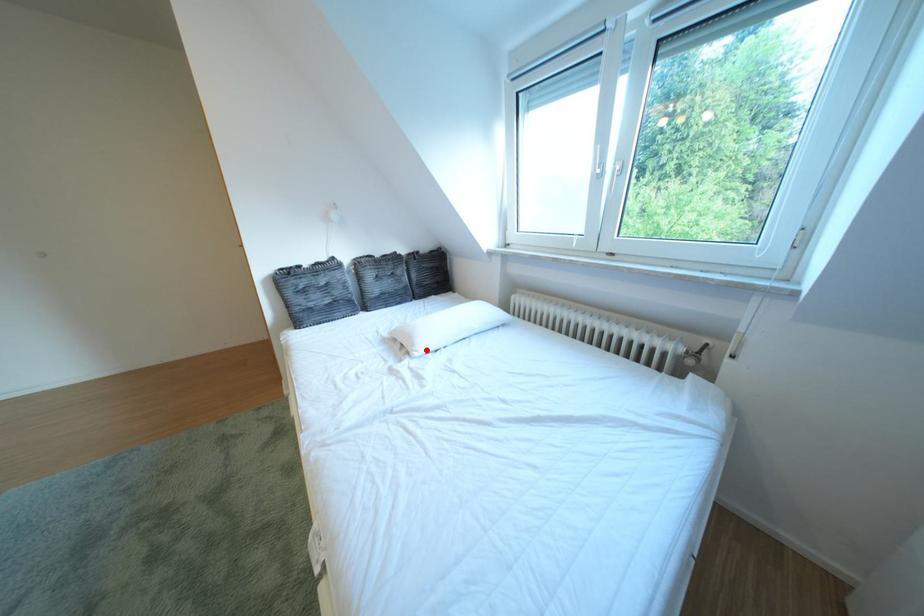
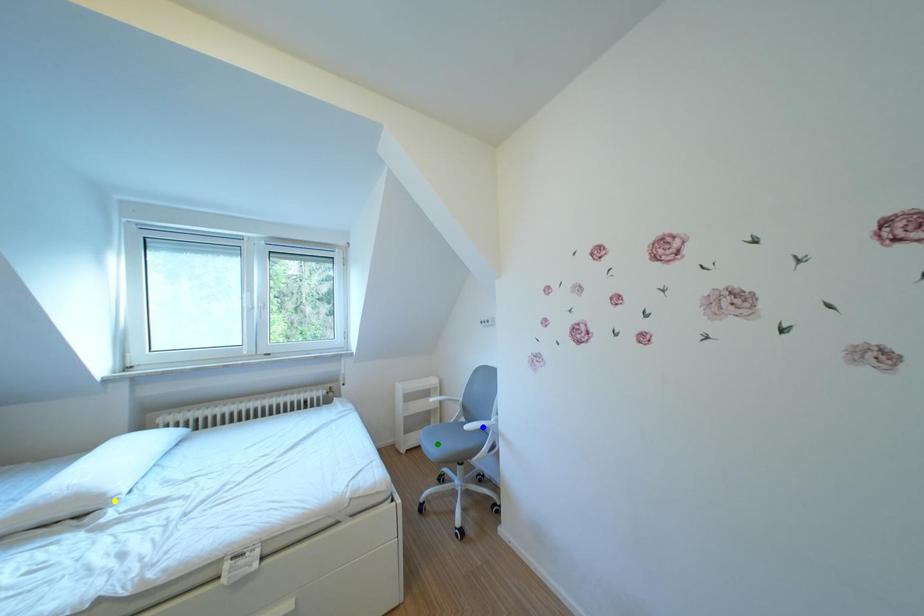
Question: I am providing you with two images of the same scene from different viewpoints. A red point is marked on the first image. You are given multiple points on the second image. In image 2, which mark is for the same physical point as the one in image 1?

Choices:
 (A) green point
 (B) blue point
 (C) yellow point

Answer: (C)